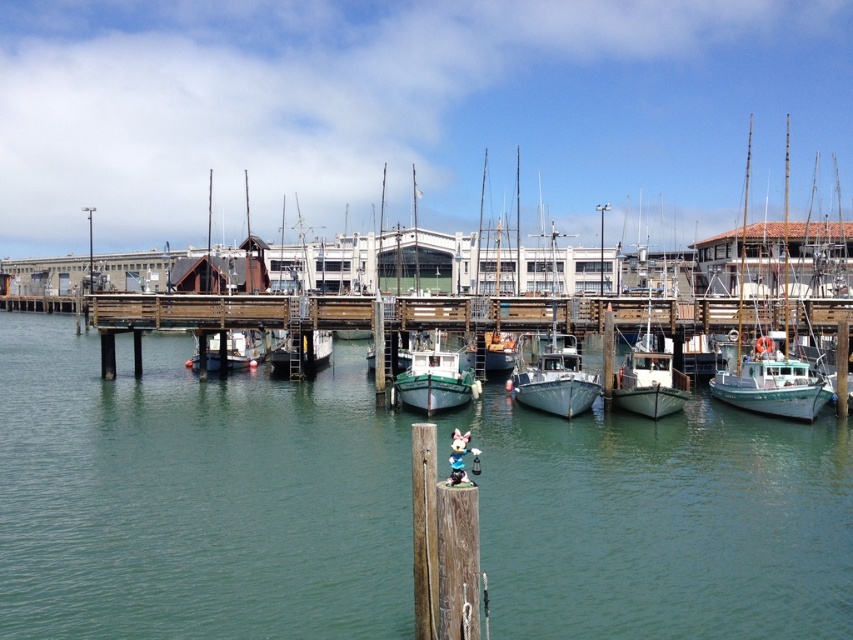
Please look at the marina scene. There is a wooden post in the foreground with a small figurine on top. In the midground, there are several boats docked. Can you tell me what is located at the point with coordinates (434, 380)?

At point (434, 380) lies the green matte boat at center.

You are standing on the wooden dock at center and want to board the teal matte boat at right. Considering their heights, will you need to climb up or step down to move from the dock to the boat?

The wooden dock at center has a lesser height compared to teal matte boat at right, so you will need to climb up to move from the dock to the boat.